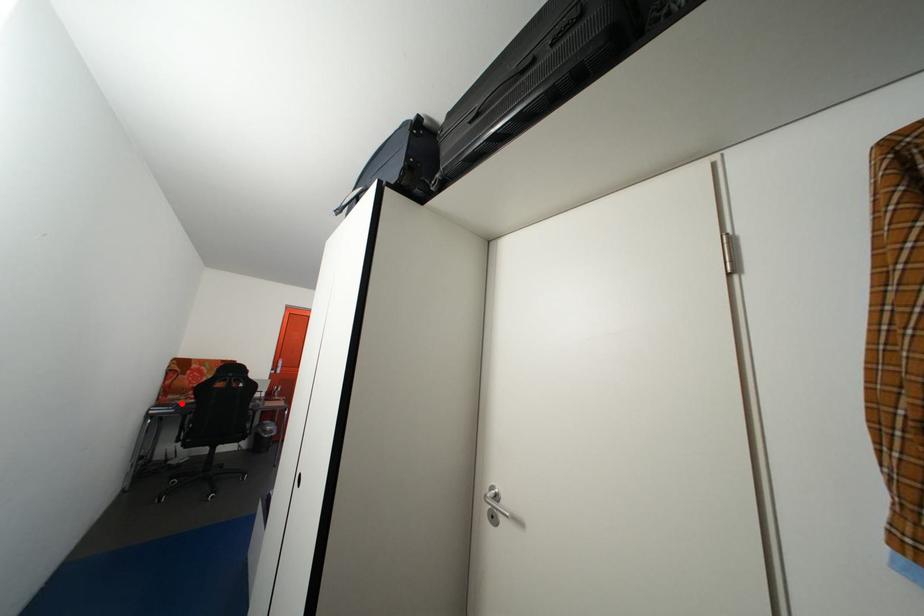
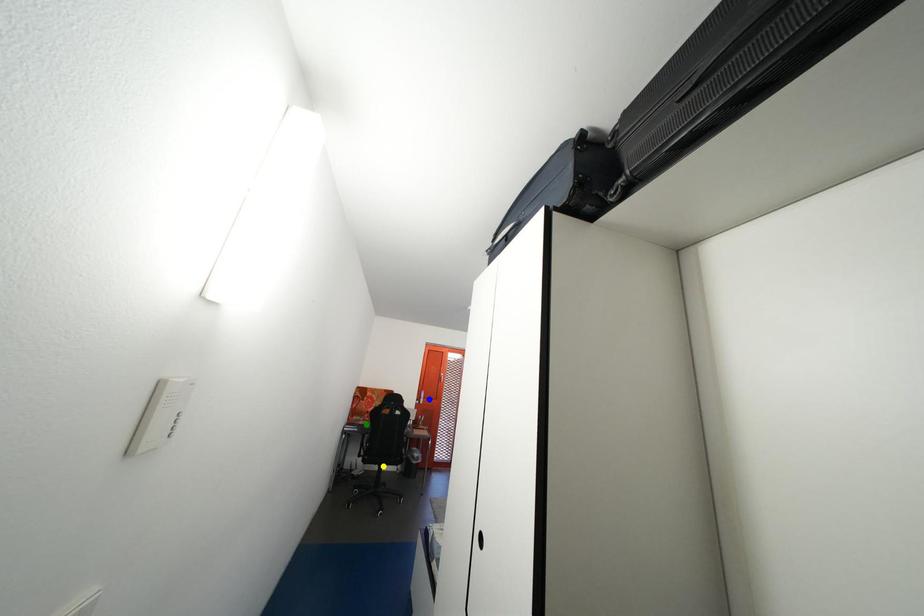
Question: I am providing you with two images of the same scene from different viewpoints. A red point is marked on the first image. You are given multiple points on the second image. Which spot in image 2 lines up with the point in image 1?

Choices:
 (A) yellow point
 (B) blue point
 (C) green point

Answer: (C)